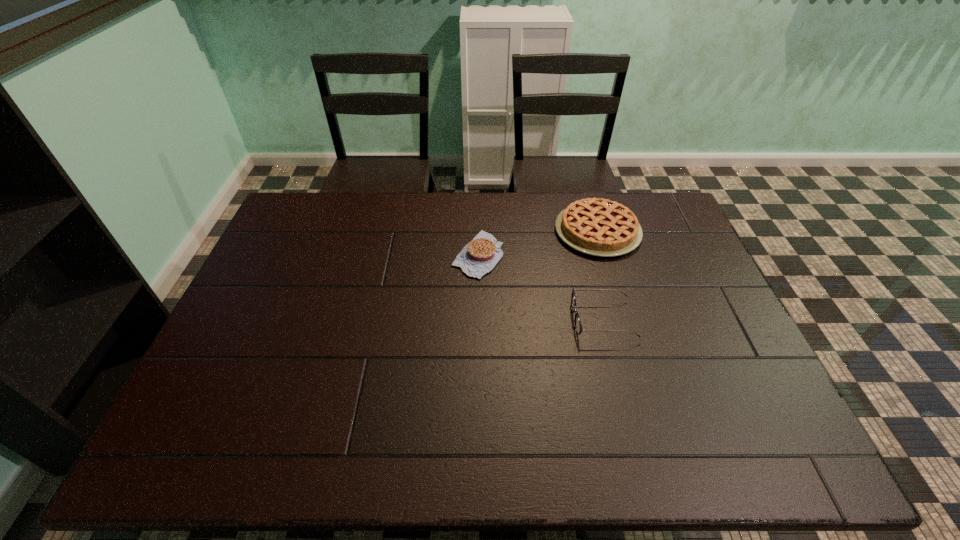
In order to click on object that is at the far right corner in this screenshot , I will do `click(600, 227)`.

Find the location of a particular element. The width and height of the screenshot is (960, 540). blank area at the far edge is located at coordinates (338, 230).

Locate an element on the screen. The image size is (960, 540). blank space at the left edge is located at coordinates (257, 337).

This screenshot has height=540, width=960. In the image, there is a desktop. In order to click on vacant space at the right edge in this screenshot , I will do `click(665, 239)`.

This screenshot has width=960, height=540. In the image, there is a desktop. Identify the location of free space at the far right corner. (648, 205).

This screenshot has height=540, width=960. Identify the location of free spot between the shortest object and the right pie. (538, 243).

Identify the location of unoccupied area between the leftmost object and the spectacles. The height and width of the screenshot is (540, 960). (540, 287).

Where is `vacant area that lies between the spectacles and the right pie`? This screenshot has width=960, height=540. vacant area that lies between the spectacles and the right pie is located at coordinates [600, 275].

Identify the location of free space between the taller pie and the spectacles. The width and height of the screenshot is (960, 540). (600, 275).

At what (x,y) coordinates should I click in order to perform the action: click on vacant point located between the taller pie and the nearest object. Please return your answer as a coordinate pair (x, y). This screenshot has height=540, width=960. Looking at the image, I should click on (600, 275).